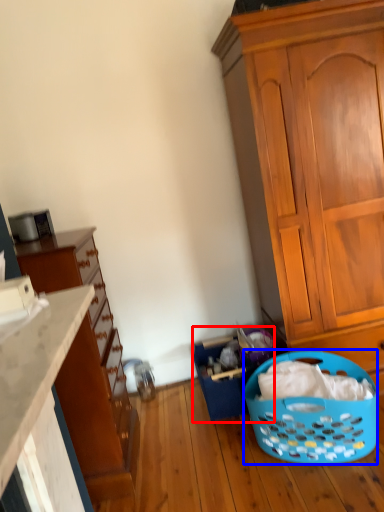
Question: Which object is further to the camera taking this photo, basket (highlighted by a red box) or picnic basket (highlighted by a blue box)?

Choices:
 (A) basket
 (B) picnic basket

Answer: (A)